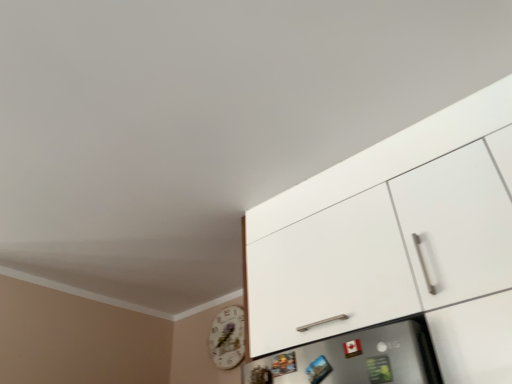
Question: Should I look upward or downward to see white wooden clock at lower left?

Choices:
 (A) down
 (B) up

Answer: (A)